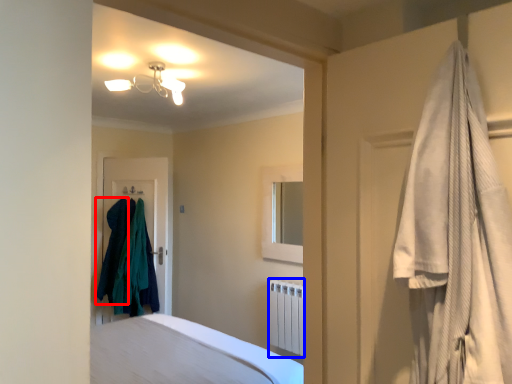
Question: Which of the following is the closest to the observer, clothing (highlighted by a red box) or radiator (highlighted by a blue box)?

Choices:
 (A) clothing
 (B) radiator

Answer: (B)